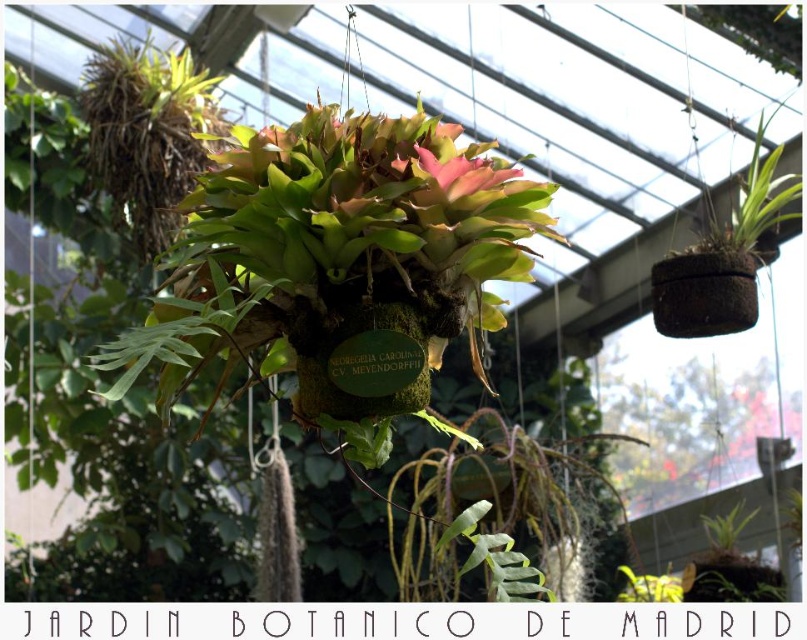
You are a visitor in the greenhouse and want to take a photo of the green mossy hanging basket at center and the pink matte flower at center. Which one will appear larger in your photo?

The green mossy hanging basket at center will appear larger in the photo because it is closer to the viewer than the pink matte flower at center.

You are a botanist examining the plants in the greenhouse. You notice the green mossy hanging basket at center and the pink matte flower at center. Which one is located to the left of the other?

The green mossy hanging basket at center is positioned on the left side of the pink matte flower at center.

You are a photographer adjusting your camera to focus on two points in the greenhouse scene. The first point is at coordinates point [299,218], and the second point is at point [490,163]. Which point should you focus on first if you want to ensure the closest object is in sharp focus?

Point [299,218] is closer to the camera than point [490,163], so you should focus on point [299,218] first to ensure the closest object is in sharp focus.